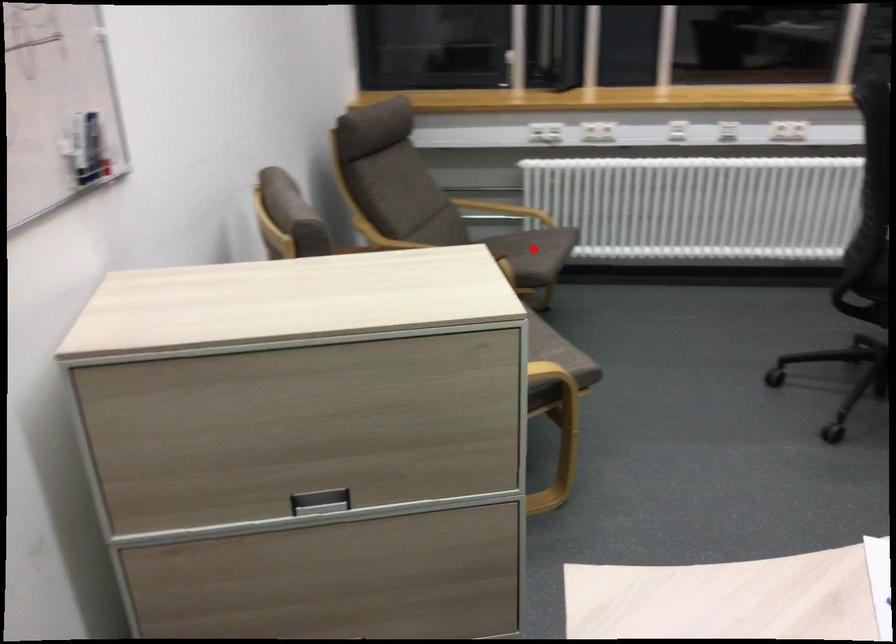
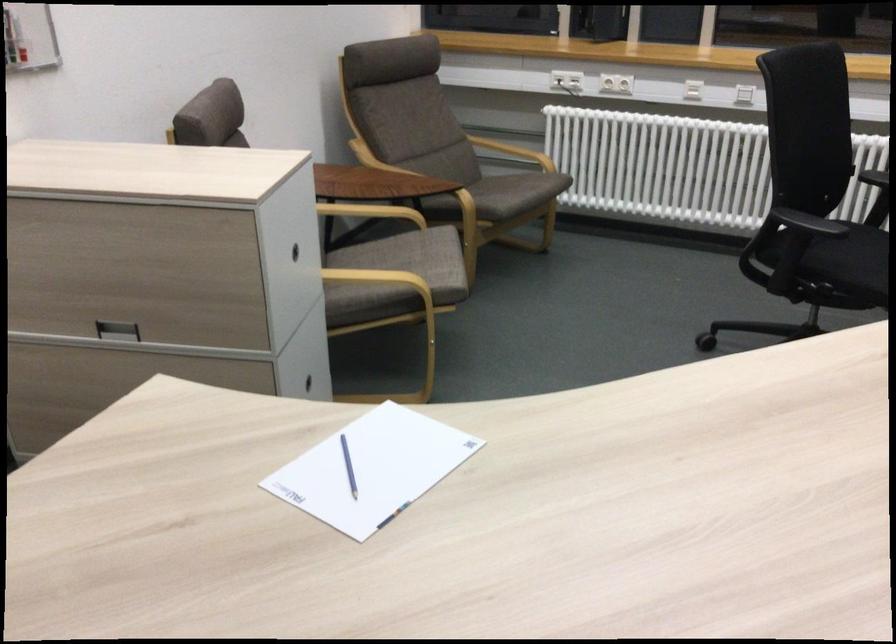
The point at the highlighted location is marked in the first image. Where is the corresponding point in the second image?

(510, 191)